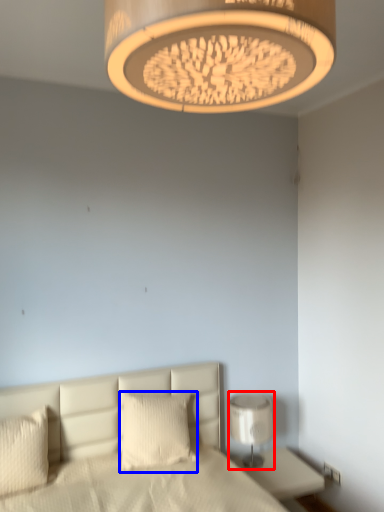
Question: Among these objects, which one is nearest to the camera, lamp (highlighted by a red box) or pillow (highlighted by a blue box)?

Choices:
 (A) lamp
 (B) pillow

Answer: (B)